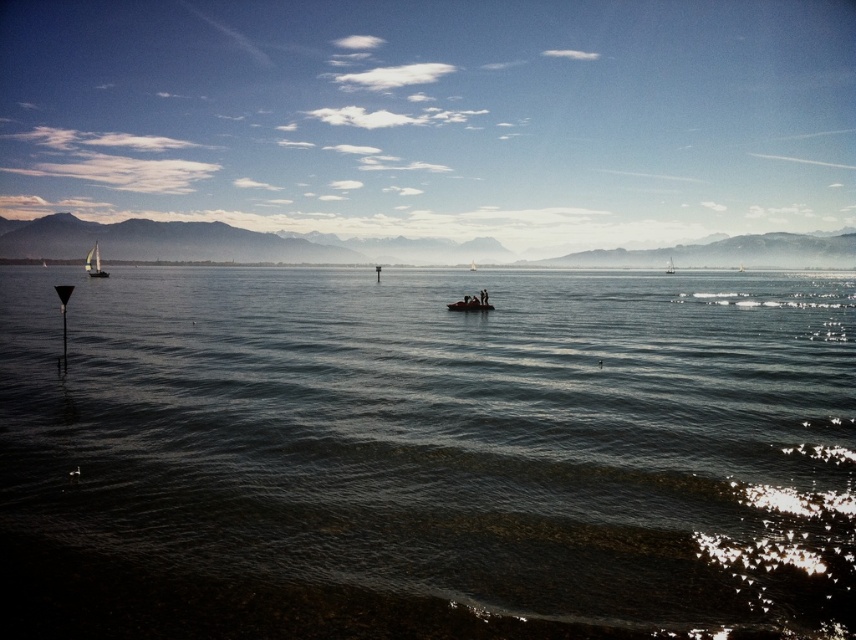
Question: Can you confirm if clear water at center is positioned to the right of white sailboat at left?

Choices:
 (A) no
 (B) yes

Answer: (B)

Question: Which object is closer to the camera taking this photo?

Choices:
 (A) white sailboat at left
 (B) metallic silver raft at center
 (C) clear water at center

Answer: (C)

Question: Estimate the real-world distances between objects in this image. Which object is closer to the white sailboat at center?

Choices:
 (A) clear water at center
 (B) metallic silver raft at center
 (C) white sailboat at left

Answer: (A)

Question: Based on their relative distances, which object is nearer to the white sailboat at left?

Choices:
 (A) metallic silver raft at center
 (B) clear water at center

Answer: (B)

Question: Can you confirm if metallic silver raft at center is bigger than white sailboat at center?

Choices:
 (A) no
 (B) yes

Answer: (A)

Question: Where is clear water at center located in relation to white sailboat at center in the image?

Choices:
 (A) below
 (B) above

Answer: (A)